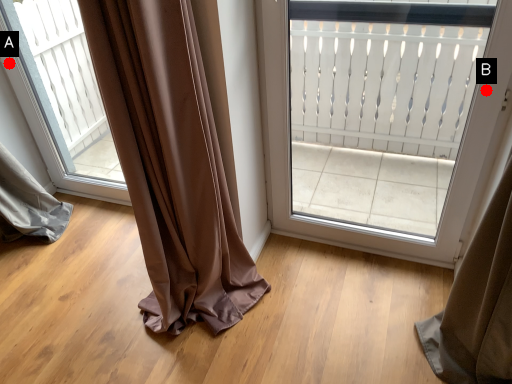
Question: Two points are circled on the image, labeled by A and B beside each circle. Which of the following is the closest to the observer?

Choices:
 (A) A is closer
 (B) B is closer

Answer: (B)